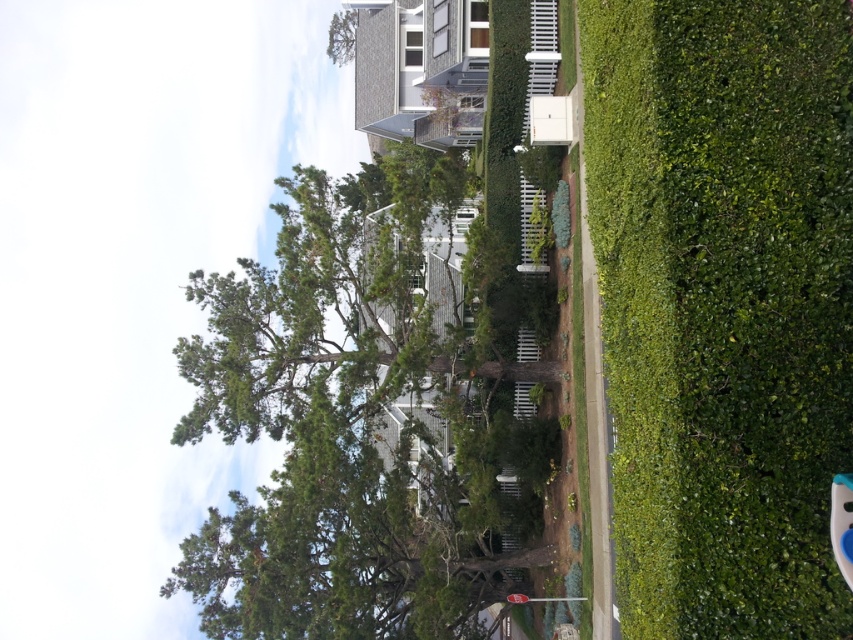
Between green leafy tree at center and green leafy tree at upper center, which one has less height?

green leafy tree at upper center is shorter.

Where is `green leafy tree at center`? green leafy tree at center is located at coordinates (350, 426).

Which is behind, point (338, 512) or point (332, 60)?

Point (332, 60)

Locate an element on the screen. This screenshot has height=640, width=853. green leafy tree at center is located at coordinates (350, 426).

Is green leafy tree at upper center above metallic silver street sign at lower center?

Yes.

Based on the photo, does green leafy tree at upper center have a lesser height compared to metallic silver street sign at lower center?

In fact, green leafy tree at upper center may be taller than metallic silver street sign at lower center.

Is point (350, 44) positioned after point (573, 596)?

Yes, point (350, 44) is farther from viewer.

Identify the location of green leafy tree at upper center. (341, 36).

Between green leafy hedge at right and metallic silver street sign at lower center, which one has more height?

green leafy hedge at right

Between point (756, 70) and point (518, 602), which one is positioned in front?

Point (756, 70) is in front.

The height and width of the screenshot is (640, 853). Identify the location of green leafy hedge at right. (723, 305).